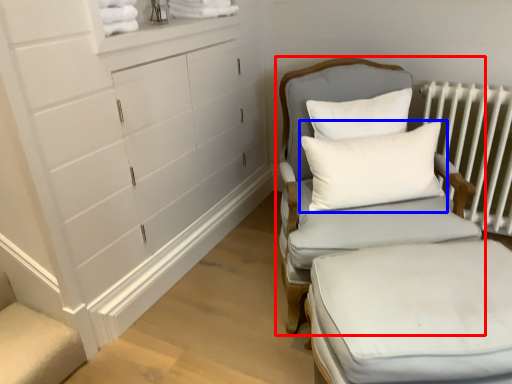
Question: Which of the following is the closest to the observer, chair (highlighted by a red box) or pillow (highlighted by a blue box)?

Choices:
 (A) chair
 (B) pillow

Answer: (A)